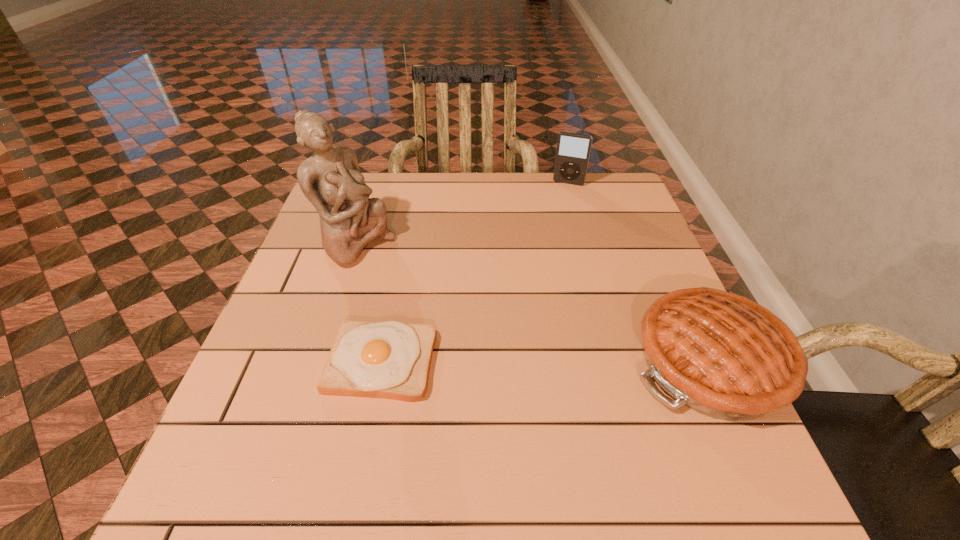
What are the coordinates of `vacant space on the desktop that is between the shortest object and the pie and is positioned on the front-facing side of the third nearest object` in the screenshot? It's located at (528, 362).

Find the location of a particular element. vacant space on the desktop that is between the toast and the second shortest object and is positioned on the front-facing side of the iPod is located at coordinates (508, 362).